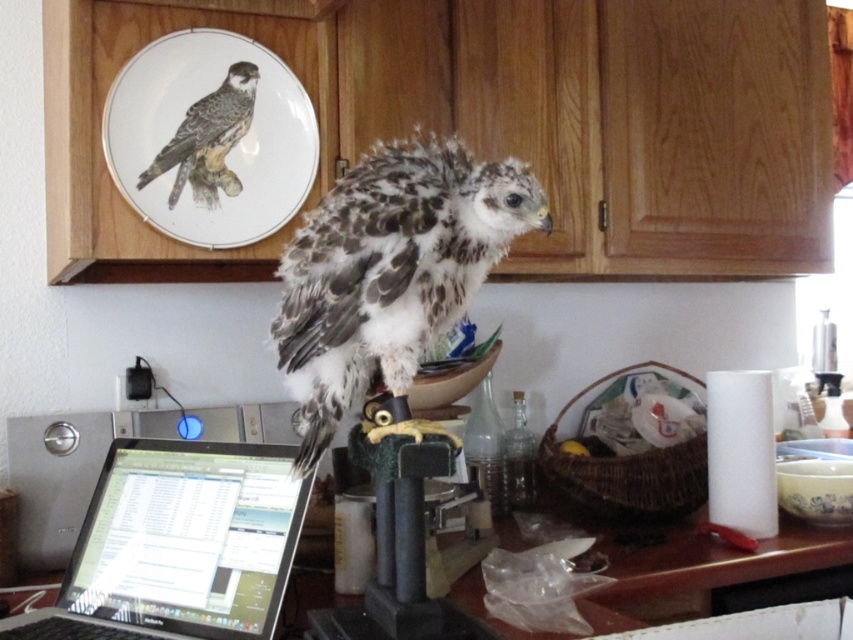
Does black glossy laptop at lower left have a greater height compared to white porcelain plate at upper center?

No, black glossy laptop at lower left is not taller than white porcelain plate at upper center.

In the scene shown: Can you confirm if black glossy laptop at lower left is bigger than white porcelain plate at upper center?

Yes, black glossy laptop at lower left is bigger than white porcelain plate at upper center.

You are a GUI agent. You are given a task and a screenshot of the screen. Output one action in this format:
    pyautogui.click(x=<x>, y=<y>)
    Task: Click on the black glossy laptop at lower left
    
    Given the screenshot: What is the action you would take?
    coord(178,545)

This screenshot has width=853, height=640. I want to click on black glossy laptop at lower left, so click(x=178, y=545).

Consider the image. Who is more distant from viewer, (518, 180) or (193, 150)?

The point (193, 150) is more distant.

Is speckled feathered falcon at center smaller than dark gray feathers at upper left?

No.

At what (x,y) coordinates should I click in order to perform the action: click on speckled feathered falcon at center. Please return your answer as a coordinate pair (x, y). Looking at the image, I should click on (390, 272).

Identify the location of speckled feathered falcon at center. (390, 272).

Can you confirm if speckled feathered falcon at center is positioned to the left of black glossy laptop at lower left?

No, speckled feathered falcon at center is not to the left of black glossy laptop at lower left.

Can you confirm if speckled feathered falcon at center is shorter than black glossy laptop at lower left?

Incorrect, speckled feathered falcon at center's height does not fall short of black glossy laptop at lower left's.

Locate an element on the screen. The height and width of the screenshot is (640, 853). speckled feathered falcon at center is located at coordinates (390, 272).